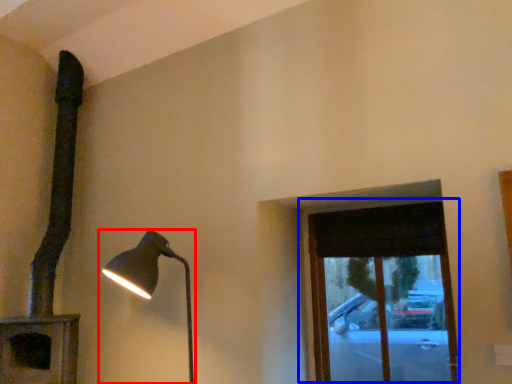
Question: Which object is closer to the camera taking this photo, lamp (highlighted by a red box) or window (highlighted by a blue box)?

Choices:
 (A) lamp
 (B) window

Answer: (A)